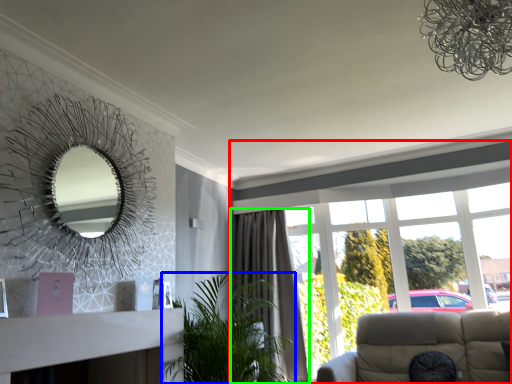
Question: Which is nearer to the window (highlighted by a red box)? houseplant (highlighted by a blue box) or curtain (highlighted by a green box).

Choices:
 (A) houseplant
 (B) curtain

Answer: (B)